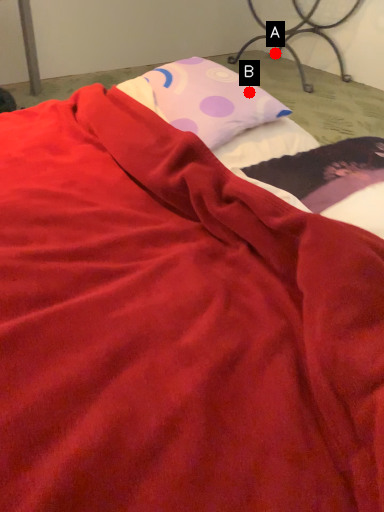
Question: Two points are circled on the image, labeled by A and B beside each circle. Which point appears farthest from the camera in this image?

Choices:
 (A) A is further
 (B) B is further

Answer: (A)